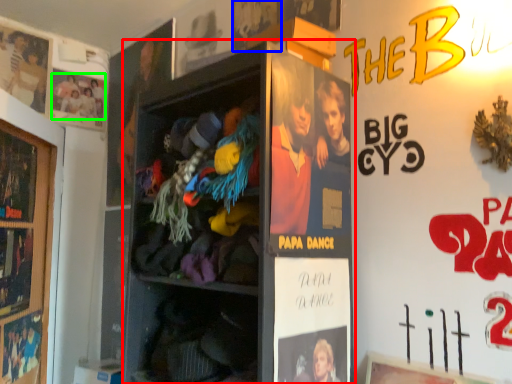
Question: Considering the real-world distances, which object is closest to shelf (highlighted by a red box)? movie poster (highlighted by a blue box) or person (highlighted by a green box).

Choices:
 (A) movie poster
 (B) person

Answer: (A)